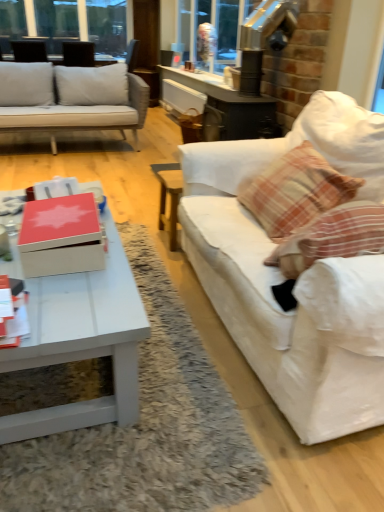
This screenshot has width=384, height=512. What do you see at coordinates (61, 236) in the screenshot? I see `matte red box at center` at bounding box center [61, 236].

The image size is (384, 512). What do you see at coordinates (296, 191) in the screenshot? I see `plaid fabric pillow at right` at bounding box center [296, 191].

Identify the location of clear glass window at upper left. The height and width of the screenshot is (512, 384). (107, 27).

Image resolution: width=384 pixels, height=512 pixels. In order to click on matte red box at center in this screenshot , I will do `click(61, 236)`.

Considering the sizes of plaid fabric pillow at right and white fabric couch at right in the image, is plaid fabric pillow at right wider or thinner than white fabric couch at right?

Clearly, plaid fabric pillow at right has less width compared to white fabric couch at right.

At what (x,y) coordinates should I click in order to perform the action: click on throw pillow above the white fabric couch at right (from the image's perspective). Please return your answer as a coordinate pair (x, y). This screenshot has height=512, width=384. Looking at the image, I should click on (296, 191).

Is plaid fabric pillow at right completely or partially outside of white fabric couch at right?

No, most part of plaid fabric pillow at right lies within white fabric couch at right.

Which is in front, plaid fabric pillow at right or white fabric couch at right?

white fabric couch at right.

Between plaid fabric pillow at right and white glossy coffee table at lower left, which one is positioned in front?

white glossy coffee table at lower left is in front.

Is plaid fabric pillow at right not close to white glossy coffee table at lower left?

No, there isn't a large distance between plaid fabric pillow at right and white glossy coffee table at lower left.

Is plaid fabric pillow at right facing towards white glossy coffee table at lower left?

Yes, plaid fabric pillow at right is facing white glossy coffee table at lower left.

At what (x,y) coordinates should I click in order to perform the action: click on box above the white fabric couch at right (from a real-world perspective). Please return your answer as a coordinate pair (x, y). The image size is (384, 512). Looking at the image, I should click on (61, 236).

Is matte red box at center positioned before white fabric couch at right?

No, the depth of matte red box at center is greater than that of white fabric couch at right.

Is point (51, 261) in front of point (359, 335)?

No, it is behind (359, 335).

Does matte red box at center have a larger size compared to white fabric couch at right?

No.

Does point (300, 148) come farther from viewer compared to point (38, 275)?

Yes, point (300, 148) is behind point (38, 275).

What's the angular difference between plaid fabric pillow at right and matte red box at center's facing directions?

The angular difference between plaid fabric pillow at right and matte red box at center is 176 degrees.

In terms of width, does plaid fabric pillow at right look wider or thinner when compared to matte red box at center?

Considering their sizes, plaid fabric pillow at right looks broader than matte red box at center.

Would you say matte red box at center is part of plaid fabric pillow at right's contents?

No.

Which point is more forward, (53, 250) or (307, 155)?

Point (53, 250)

From the image's perspective, does matte red box at center appear lower than plaid fabric pillow at right?

Yes, from the image's perspective, matte red box at center is beneath plaid fabric pillow at right.

Which of these two, matte red box at center or plaid fabric pillow at right, is bigger?

Bigger between the two is plaid fabric pillow at right.

Based on their sizes in the image, would you say matte black armchair at upper left is bigger or smaller than clear glass window at upper left?

In the image, matte black armchair at upper left appears to be smaller than clear glass window at upper left.

Considering the sizes of matte black armchair at upper left and clear glass window at upper left in the image, is matte black armchair at upper left taller or shorter than clear glass window at upper left?

Considering their sizes, matte black armchair at upper left has less height than clear glass window at upper left.

Does matte black armchair at upper left turn towards clear glass window at upper left?

Yes, matte black armchair at upper left is turned towards clear glass window at upper left.

Considering the positions of objects matte black armchair at upper left and clear glass window at upper left in the image provided, who is in front, matte black armchair at upper left or clear glass window at upper left?

matte black armchair at upper left is more forward.

How different are the orientations of white fabric couch at right and clear glass window at upper left in degrees?

90 degrees.

Considering the positions of point (361, 113) and point (48, 17), is point (361, 113) closer or farther from the camera than point (48, 17)?

Point (361, 113) appears to be closer to the viewer than point (48, 17).

From the image's perspective, which is above, white fabric couch at right or clear glass window at upper left?

clear glass window at upper left.

Considering the relative sizes of white fabric couch at right and clear glass window at upper left in the image provided, is white fabric couch at right shorter than clear glass window at upper left?

Yes.

Locate an element on the screen. studio couch in front of the plaid fabric pillow at right is located at coordinates (300, 275).

In the image, there is a plaid fabric pillow at right. Identify the location of coffee table below it (from a real-world perspective). Image resolution: width=384 pixels, height=512 pixels. (82, 341).

Based on their spatial positions, is plaid fabric pillow at right or matte black armchair at upper left further from clear glass window at upper left?

Among the two, plaid fabric pillow at right is located further to clear glass window at upper left.

Looking at the image, which one is located closer to matte red box at center, clear glass window at upper left or white fabric couch at right?

white fabric couch at right is positioned closer to the anchor matte red box at center.

Looking at the image, which one is located further to matte black armchair at upper left, plaid fabric pillow at right or white fabric couch at right?

Based on the image, white fabric couch at right appears to be further to matte black armchair at upper left.

From the image, which object appears to be farther from clear glass window at upper left, white fabric couch at right or plaid fabric pillow at right?

Among the two, white fabric couch at right is located further to clear glass window at upper left.

When comparing their distances from plaid fabric pillow at right, does matte red box at center or white fabric couch at right seem further?

matte red box at center.

In the scene shown: When comparing their distances from matte red box at center, does matte black armchair at upper left or plaid fabric pillow at right seem closer?

plaid fabric pillow at right is closer to matte red box at center.

When comparing their distances from white glossy coffee table at lower left, does white fabric couch at right or matte black armchair at upper left seem closer?

The object closer to white glossy coffee table at lower left is white fabric couch at right.

Based on their spatial positions, is matte black armchair at upper left or clear glass window at upper left closer to white fabric couch at right?

Among the two, matte black armchair at upper left is located nearer to white fabric couch at right.

The width and height of the screenshot is (384, 512). What are the coordinates of `box located between white fabric couch at right and matte black armchair at upper left in the depth direction` in the screenshot? It's located at (61, 236).

I want to click on throw pillow between matte red box at center and clear glass window at upper left along the z-axis, so click(296, 191).

You are a GUI agent. You are given a task and a screenshot of the screen. Output one action in this format:
    pyautogui.click(x=<x>, y=<y>)
    Task: Click on the armchair located between white fabric couch at right and clear glass window at upper left in the depth direction
    This screenshot has width=384, height=512.
    Given the screenshot: What is the action you would take?
    pyautogui.click(x=78, y=54)

Identify the location of armchair between plaid fabric pillow at right and clear glass window at upper left along the z-axis. The width and height of the screenshot is (384, 512). (78, 54).